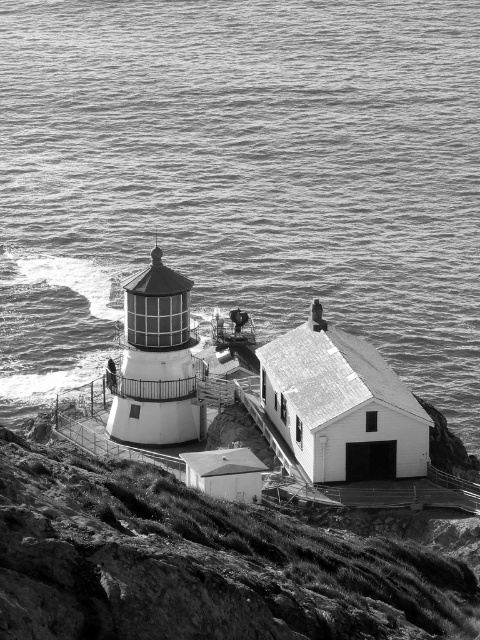
Can you confirm if water at upper center is positioned to the right of rugged stone cliff at lower left?

Incorrect, water at upper center is not on the right side of rugged stone cliff at lower left.

In the scene shown: Is the position of water at upper center less distant than that of rugged stone cliff at lower left?

That is False.

Which is in front, point (440, 13) or point (175, 531)?

Point (175, 531)

At what (x,y) coordinates should I click in order to perform the action: click on water at upper center. Please return your answer as a coordinate pair (x, y). The image size is (480, 640). Looking at the image, I should click on (241, 177).